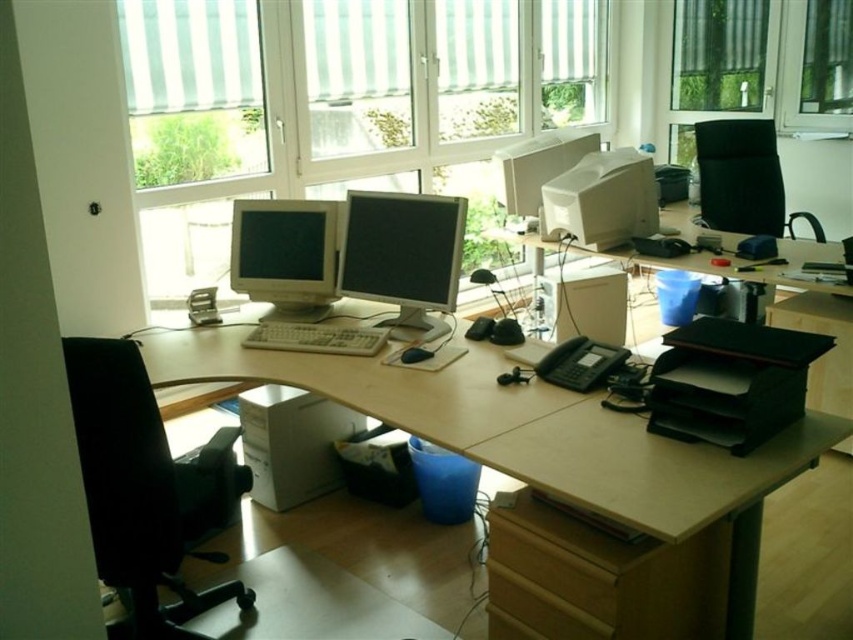
You are an office worker who needs to move the black plastic printer at right to a new location. However, you must ensure that it doesn not exceed the space currently occupied by the black mesh office chair at upper right. Is this possible?

The black plastic printer at right has a smaller size compared to black mesh office chair at upper right, so yes, it can be moved to the space occupied by the black mesh office chair at upper right since it is smaller and will fit within that area.

Looking at this image, you are a delivery person who needs to place a package on the desk without moving any objects. The package requires 3 meters of space to be placed safely. Can you place it between the matte gray monitor at center and yourself?

The distance between the matte gray monitor at center and the viewer is 2.69 meters, which is less than the required 3 meters. Therefore, the package cannot be placed safely in that space.